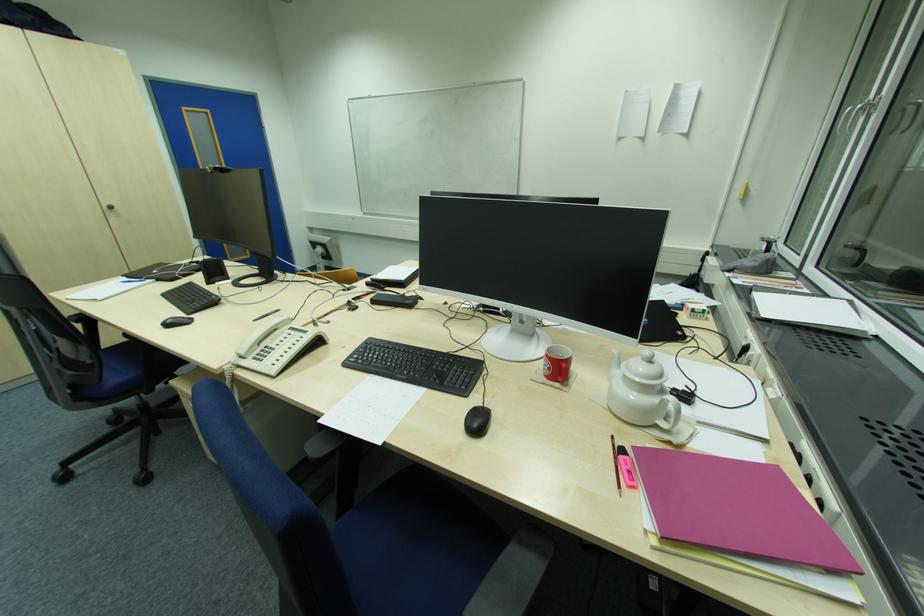
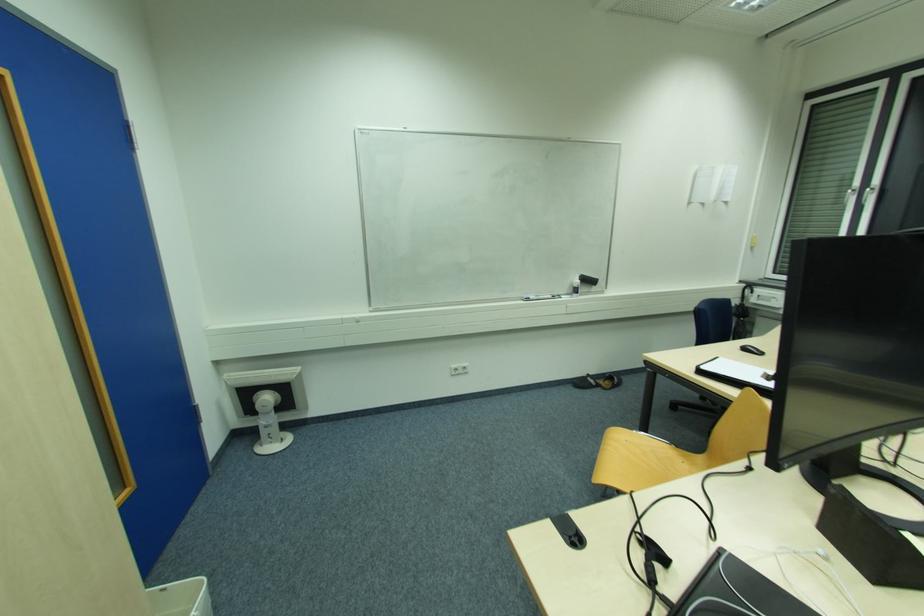
In the second image, find the point that corresponds to [458,103] in the first image.

(550, 158)